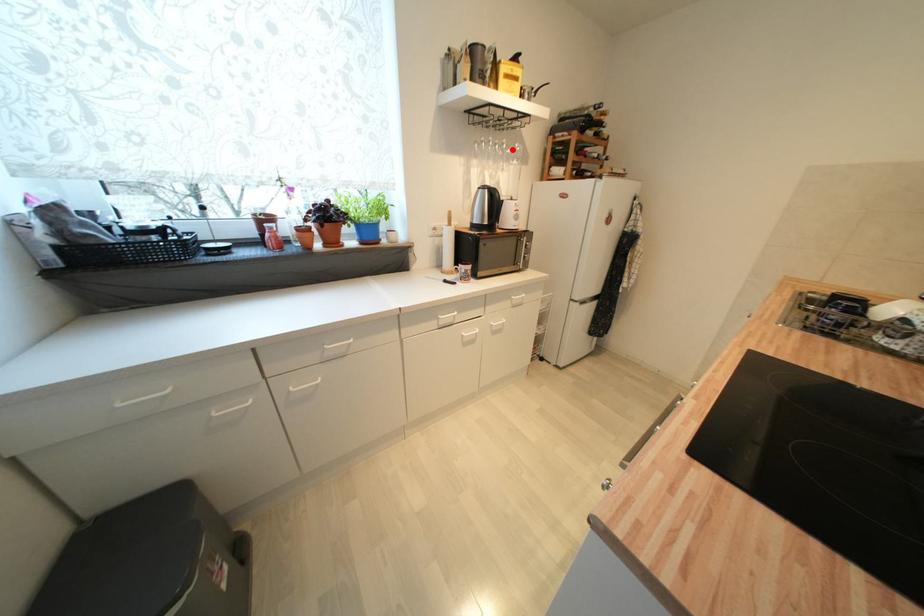
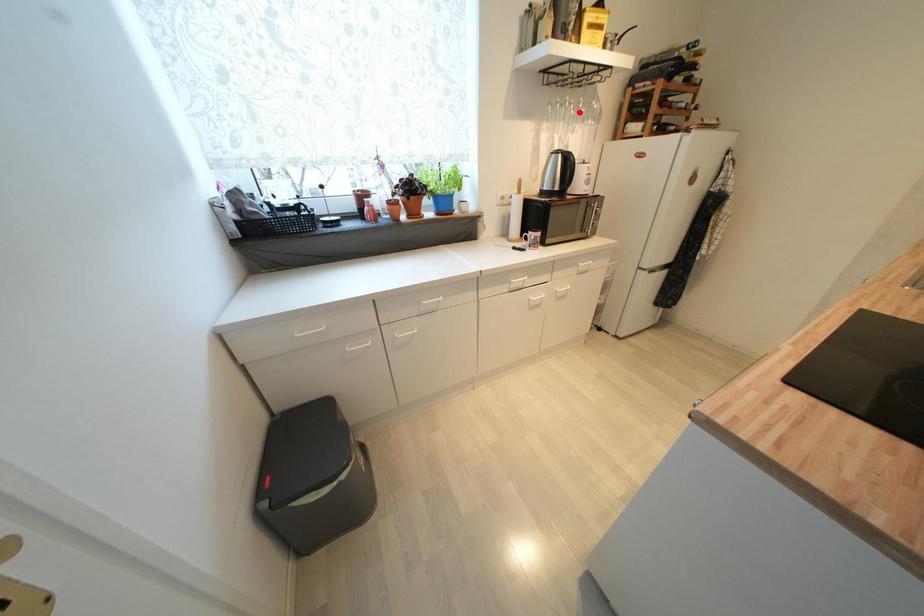
I am providing you with two images of the same scene from different viewpoints. A red point is marked on the first image and another point is marked on the second image. Do the highlighted points in image1 and image2 indicate the same real-world spot?

No